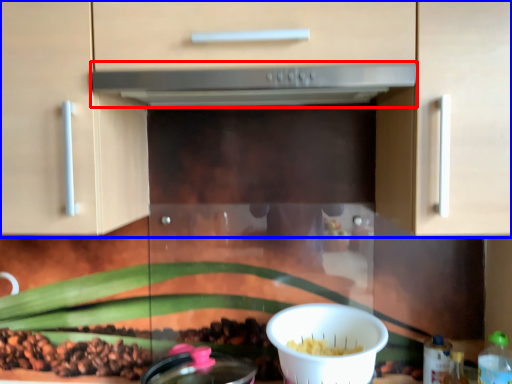
Question: Which point is further to the camera, home appliance (highlighted by a red box) or cabinetry (highlighted by a blue box)?

Choices:
 (A) home appliance
 (B) cabinetry

Answer: (A)